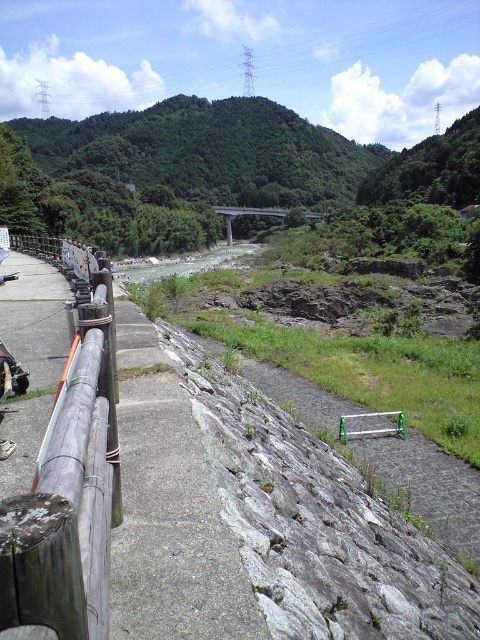
Question: Among these points, which one is nearest to the camera?

Choices:
 (A) (110, 406)
 (B) (169, 275)
 (C) (250, 582)

Answer: (C)

Question: Which point is closer to the camera taking this photo?

Choices:
 (A) (19, 534)
 (B) (199, 621)
 (C) (186, 273)

Answer: (A)

Question: Is gray concrete path at center positioned behind clear water at center?

Choices:
 (A) yes
 (B) no

Answer: (B)

Question: Which object is closer to the camera taking this photo?

Choices:
 (A) brown wood rail at left
 (B) gray concrete path at center
 (C) clear water at center

Answer: (B)

Question: Does gray concrete path at center have a lesser width compared to brown wood rail at left?

Choices:
 (A) yes
 (B) no

Answer: (B)

Question: Does brown wood rail at left have a greater width compared to clear water at center?

Choices:
 (A) no
 (B) yes

Answer: (A)